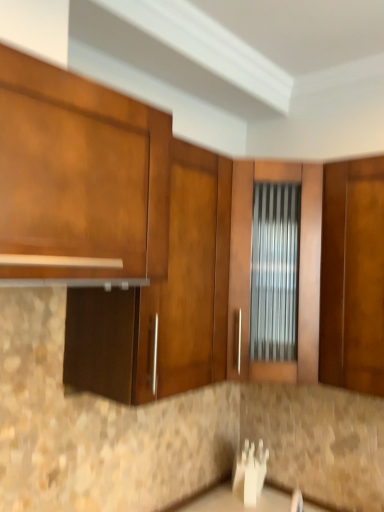
Image resolution: width=384 pixels, height=512 pixels. I want to click on matte wood cabinet at center, the 1th cabinetry positioned from the back, so click(163, 300).

Describe the element at coordinates (163, 300) in the screenshot. I see `matte wood cabinet at center, the 1th cabinetry positioned from the back` at that location.

Identify the location of matte wood cabinet at upper left, marked as the 2th cabinetry in a back-to-front arrangement. The height and width of the screenshot is (512, 384). tap(79, 180).

The width and height of the screenshot is (384, 512). What do you see at coordinates (79, 180) in the screenshot?
I see `matte wood cabinet at upper left, marked as the 2th cabinetry in a back-to-front arrangement` at bounding box center [79, 180].

What are the coordinates of `matte wood cabinet at center, which ranks as the second cabinetry in front-to-back order` in the screenshot? It's located at (163, 300).

Can you confirm if matte wood cabinet at center, the 1th cabinetry positioned from the back, is positioned to the left of matte wood cabinet at upper left, placed as the 1th cabinetry when sorted from front to back?

No.

Is matte wood cabinet at center, which ranks as the second cabinetry in front-to-back order, positioned in front of matte wood cabinet at upper left, placed as the 1th cabinetry when sorted from front to back?

No, it is not.

Which is in front, point (217, 220) or point (66, 214)?

The point (66, 214) is closer.

From the image's perspective, is matte wood cabinet at center, the 1th cabinetry positioned from the back, located above or below matte wood cabinet at upper left, placed as the 1th cabinetry when sorted from front to back?

matte wood cabinet at center, the 1th cabinetry positioned from the back, is situated lower than matte wood cabinet at upper left, placed as the 1th cabinetry when sorted from front to back, in the image.

From a real-world perspective, is matte wood cabinet at center, the 1th cabinetry positioned from the back, physically located above or below matte wood cabinet at upper left, marked as the 2th cabinetry in a back-to-front arrangement?

In terms of real-world spatial position, matte wood cabinet at center, the 1th cabinetry positioned from the back, is below matte wood cabinet at upper left, marked as the 2th cabinetry in a back-to-front arrangement.

Between matte wood cabinet at center, the 1th cabinetry positioned from the back, and matte wood cabinet at upper left, marked as the 2th cabinetry in a back-to-front arrangement, which one has larger width?

Wider between the two is matte wood cabinet at upper left, marked as the 2th cabinetry in a back-to-front arrangement.

Which of these two, matte wood cabinet at center, which ranks as the second cabinetry in front-to-back order, or matte wood cabinet at upper left, marked as the 2th cabinetry in a back-to-front arrangement, stands taller?

With more height is matte wood cabinet at center, which ranks as the second cabinetry in front-to-back order.

Considering the relative sizes of matte wood cabinet at center, the 1th cabinetry positioned from the back, and matte wood cabinet at upper left, placed as the 1th cabinetry when sorted from front to back, in the image provided, is matte wood cabinet at center, the 1th cabinetry positioned from the back, bigger than matte wood cabinet at upper left, placed as the 1th cabinetry when sorted from front to back,?

Yes, matte wood cabinet at center, the 1th cabinetry positioned from the back, is bigger than matte wood cabinet at upper left, placed as the 1th cabinetry when sorted from front to back.

Can matte wood cabinet at upper left, marked as the 2th cabinetry in a back-to-front arrangement, be found inside matte wood cabinet at center, the 1th cabinetry positioned from the back?

No, matte wood cabinet at upper left, marked as the 2th cabinetry in a back-to-front arrangement, is not inside matte wood cabinet at center, the 1th cabinetry positioned from the back.

Is matte wood cabinet at center, which ranks as the second cabinetry in front-to-back order, not close to matte wood cabinet at upper left, placed as the 1th cabinetry when sorted from front to back?

They are positioned close to each other.

Is matte wood cabinet at upper left, placed as the 1th cabinetry when sorted from front to back, at the back of matte wood cabinet at center, which ranks as the second cabinetry in front-to-back order?

No, matte wood cabinet at center, which ranks as the second cabinetry in front-to-back order, is not facing away from matte wood cabinet at upper left, placed as the 1th cabinetry when sorted from front to back.

Locate an element on the screen. cabinetry directly beneath the matte wood cabinet at upper left, placed as the 1th cabinetry when sorted from front to back (from a real-world perspective) is located at coordinates (163, 300).

Between matte wood cabinet at upper left, placed as the 1th cabinetry when sorted from front to back, and matte wood cabinet at center, the 1th cabinetry positioned from the back, which one appears on the left side from the viewer's perspective?

matte wood cabinet at upper left, placed as the 1th cabinetry when sorted from front to back.

Which is behind, matte wood cabinet at upper left, placed as the 1th cabinetry when sorted from front to back, or matte wood cabinet at center, which ranks as the second cabinetry in front-to-back order?

Positioned behind is matte wood cabinet at center, which ranks as the second cabinetry in front-to-back order.

Which is behind, point (98, 217) or point (171, 383)?

The point (171, 383) is behind.

From the image's perspective, which one is positioned lower, matte wood cabinet at upper left, marked as the 2th cabinetry in a back-to-front arrangement, or matte wood cabinet at center, which ranks as the second cabinetry in front-to-back order?

matte wood cabinet at center, which ranks as the second cabinetry in front-to-back order, is shown below in the image.

From a real-world perspective, which is physically above, matte wood cabinet at upper left, placed as the 1th cabinetry when sorted from front to back, or matte wood cabinet at center, the 1th cabinetry positioned from the back?

matte wood cabinet at upper left, placed as the 1th cabinetry when sorted from front to back, from a real-world perspective.

Which object is thinner, matte wood cabinet at upper left, marked as the 2th cabinetry in a back-to-front arrangement, or matte wood cabinet at center, which ranks as the second cabinetry in front-to-back order?

matte wood cabinet at center, which ranks as the second cabinetry in front-to-back order, is thinner.

From their relative heights in the image, would you say matte wood cabinet at upper left, placed as the 1th cabinetry when sorted from front to back, is taller or shorter than matte wood cabinet at center, the 1th cabinetry positioned from the back?

In the image, matte wood cabinet at upper left, placed as the 1th cabinetry when sorted from front to back, appears to be shorter than matte wood cabinet at center, the 1th cabinetry positioned from the back.

Considering the sizes of matte wood cabinet at upper left, marked as the 2th cabinetry in a back-to-front arrangement, and matte wood cabinet at center, which ranks as the second cabinetry in front-to-back order, in the image, is matte wood cabinet at upper left, marked as the 2th cabinetry in a back-to-front arrangement, bigger or smaller than matte wood cabinet at center, which ranks as the second cabinetry in front-to-back order,?

Clearly, matte wood cabinet at upper left, marked as the 2th cabinetry in a back-to-front arrangement, is smaller in size than matte wood cabinet at center, which ranks as the second cabinetry in front-to-back order.

Is matte wood cabinet at center, the 1th cabinetry positioned from the back, surrounded by matte wood cabinet at upper left, marked as the 2th cabinetry in a back-to-front arrangement?

No.

Is matte wood cabinet at upper left, placed as the 1th cabinetry when sorted from front to back, touching matte wood cabinet at center, which ranks as the second cabinetry in front-to-back order?

No.

Could you tell me if matte wood cabinet at upper left, placed as the 1th cabinetry when sorted from front to back, is turned towards matte wood cabinet at center, which ranks as the second cabinetry in front-to-back order?

No, matte wood cabinet at upper left, placed as the 1th cabinetry when sorted from front to back, is not aimed at matte wood cabinet at center, which ranks as the second cabinetry in front-to-back order.

What's the angular difference between matte wood cabinet at upper left, marked as the 2th cabinetry in a back-to-front arrangement, and matte wood cabinet at center, which ranks as the second cabinetry in front-to-back order,'s facing directions?

The angular difference between matte wood cabinet at upper left, marked as the 2th cabinetry in a back-to-front arrangement, and matte wood cabinet at center, which ranks as the second cabinetry in front-to-back order, is 0.946 degrees.

How far apart are matte wood cabinet at upper left, marked as the 2th cabinetry in a back-to-front arrangement, and matte wood cabinet at center, the 1th cabinetry positioned from the back?

12.00 inches.

Find the location of a particular element. Image resolution: width=384 pixels, height=512 pixels. cabinetry on the right of the matte wood cabinet at upper left, placed as the 1th cabinetry when sorted from front to back is located at coordinates (163, 300).

Identify the location of cabinetry in front of the matte wood cabinet at center, which ranks as the second cabinetry in front-to-back order. The width and height of the screenshot is (384, 512). (79, 180).

Image resolution: width=384 pixels, height=512 pixels. In order to click on cabinetry that is below the matte wood cabinet at upper left, placed as the 1th cabinetry when sorted from front to back (from the image's perspective) in this screenshot , I will do `click(163, 300)`.